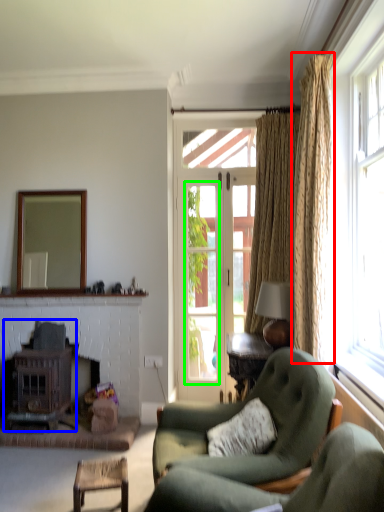
Question: Estimate the real-world distances between objects in this image. Which object is farther from curtain (highlighted by a red box), stove (highlighted by a blue box) or window screen (highlighted by a green box)?

Choices:
 (A) stove
 (B) window screen

Answer: (A)